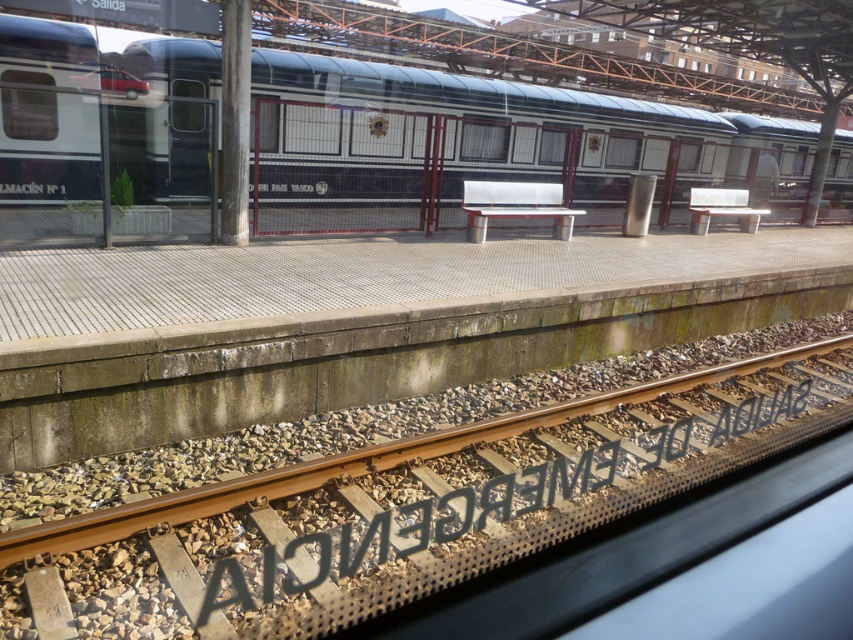
Does brown gravel track at lower center have a larger size compared to polished metal train at center?

No.

Does point (94, 564) lie in front of point (360, 205)?

Yes.

I want to click on brown gravel track at lower center, so click(422, 516).